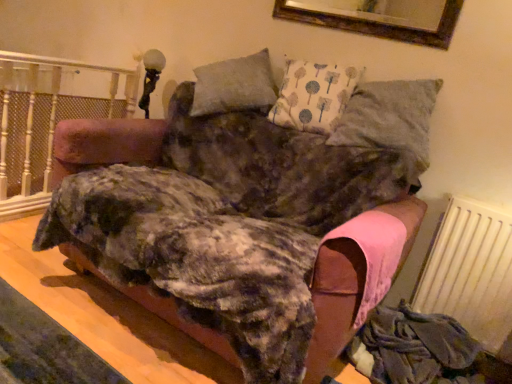
Question: Visually, is white painted wood at left positioned to the left or to the right of textured gray pillow at upper right?

Choices:
 (A) left
 (B) right

Answer: (A)

Question: Is white painted wood at left taller or shorter than textured gray pillow at upper right?

Choices:
 (A) tall
 (B) short

Answer: (A)

Question: Which of these objects is positioned farthest from the textured gray pillow at upper right?

Choices:
 (A) white textured radiator at lower right
 (B) white painted wood at left
 (C) velvet pink sofa at center

Answer: (B)

Question: Based on their relative distances, which object is farther from the velvet pink sofa at center?

Choices:
 (A) textured gray pillow at upper right
 (B) white textured radiator at lower right
 (C) white painted wood at left

Answer: (C)